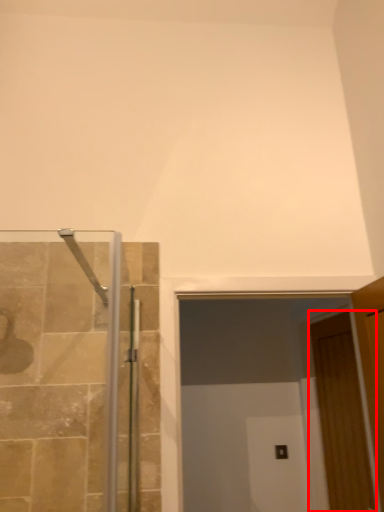
Question: Observing the image, what is the correct spatial positioning of door (annotated by the red box) in reference to glass door?

Choices:
 (A) right
 (B) left

Answer: (A)